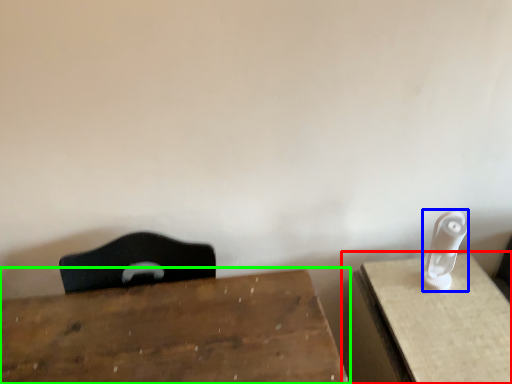
Question: Which object is positioned farthest from table (highlighted by a red box)? Select from Wii controller (highlighted by a blue box) and table (highlighted by a green box).

Choices:
 (A) Wii controller
 (B) table

Answer: (B)